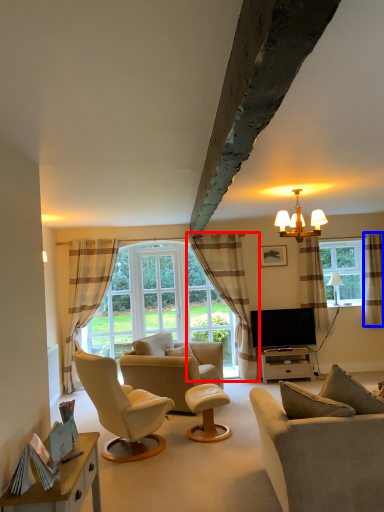
Question: Which of the following is the closest to the observer, curtain (highlighted by a red box) or curtain (highlighted by a blue box)?

Choices:
 (A) curtain
 (B) curtain

Answer: (A)